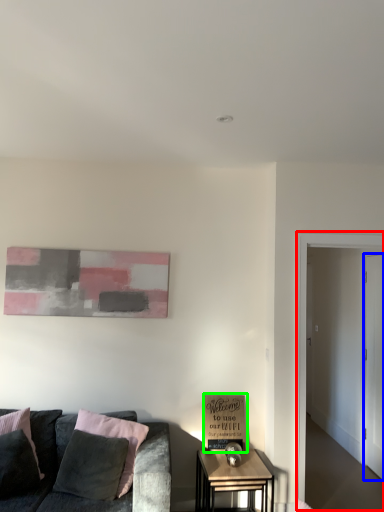
Question: Which object is positioned closest to glass door (highlighted by a red box)? Select from glass door (highlighted by a blue box) and cardboard box (highlighted by a green box).

Choices:
 (A) glass door
 (B) cardboard box

Answer: (B)